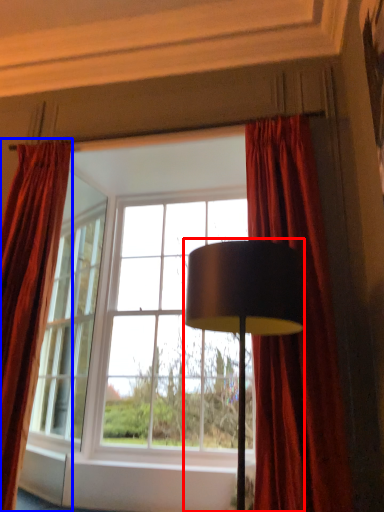
Question: Which object is further to the camera taking this photo, lamp (highlighted by a red box) or curtain (highlighted by a blue box)?

Choices:
 (A) lamp
 (B) curtain

Answer: (B)